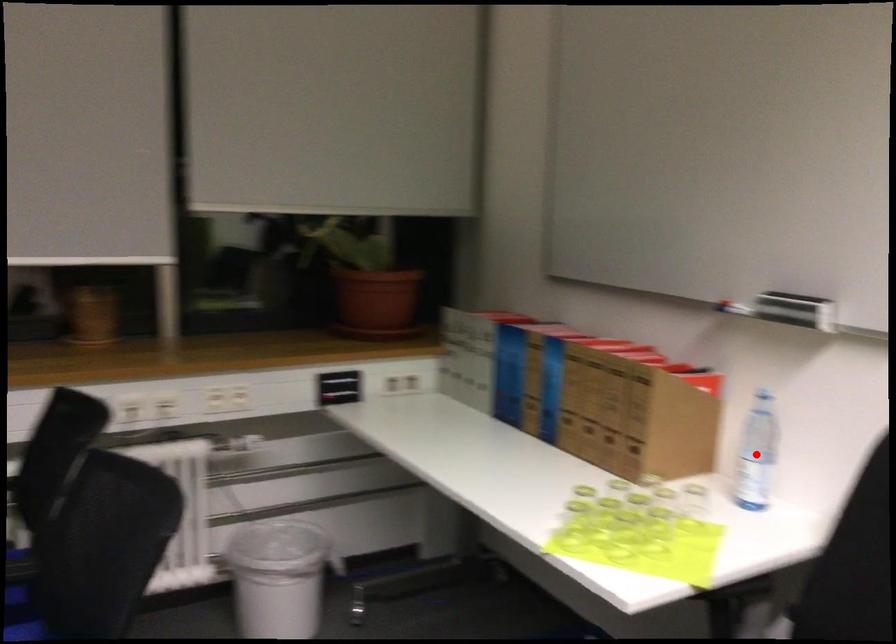
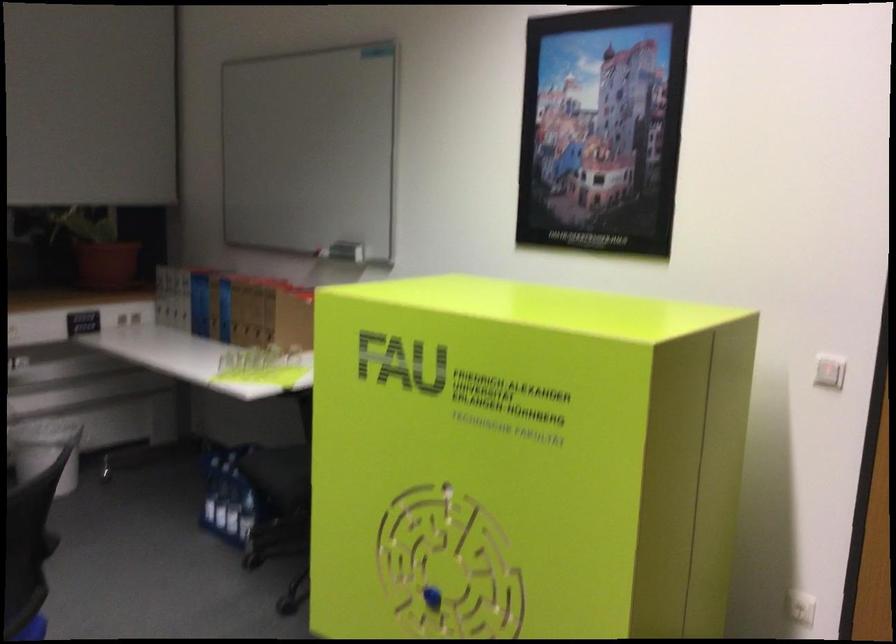
Question: I am providing you with two images of the same scene from different viewpoints. A red point is marked on the first image. Can you still see the location of the red point in image 2?

Choices:
 (A) Yes
 (B) No

Answer: (B)